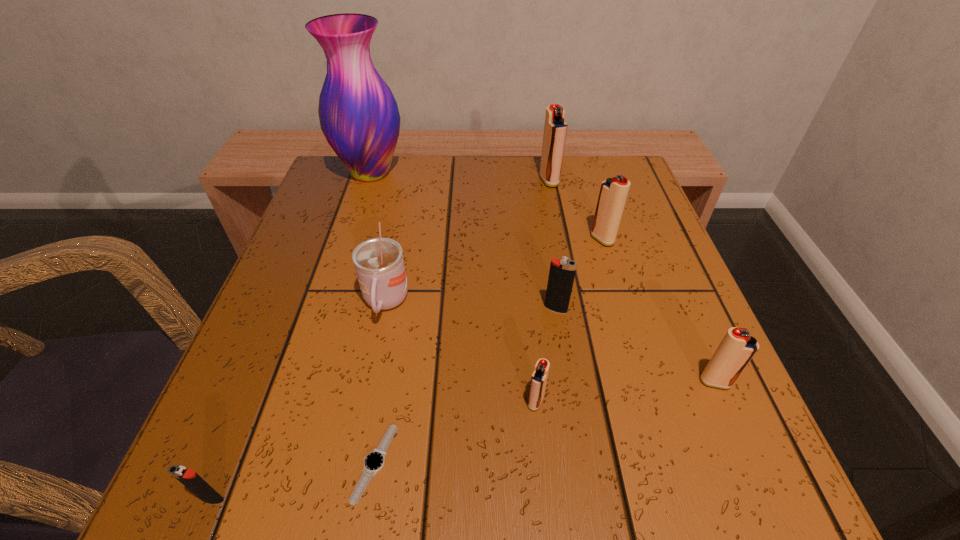
Where is `the rightmost igniter`? This screenshot has width=960, height=540. the rightmost igniter is located at coordinates (737, 348).

I want to click on the smallest red igniter, so click(539, 377).

Where is `the leftmost red igniter`? This screenshot has width=960, height=540. the leftmost red igniter is located at coordinates (539, 377).

Identify the location of the leftmost igniter. The width and height of the screenshot is (960, 540). (189, 478).

Find the location of a particular element. the nearer black igniter is located at coordinates (189, 478).

Where is `watch`? This screenshot has height=540, width=960. watch is located at coordinates (374, 461).

This screenshot has width=960, height=540. In order to click on free space located on the front of the vase in this screenshot , I will do `click(340, 268)`.

Where is `free space located 0.050m on the right of the biggest red igniter`? free space located 0.050m on the right of the biggest red igniter is located at coordinates point(579,180).

You are a GUI agent. You are given a task and a screenshot of the screen. Output one action in this format:
    pyautogui.click(x=<x>, y=<y>)
    Task: Click on the vacant space located on the front of the eighth object from left to right
    The height and width of the screenshot is (540, 960).
    Given the screenshot: What is the action you would take?
    pyautogui.click(x=653, y=406)

Find the location of a particular element. blank area located 0.180m on the side with the handle of the cup is located at coordinates (359, 434).